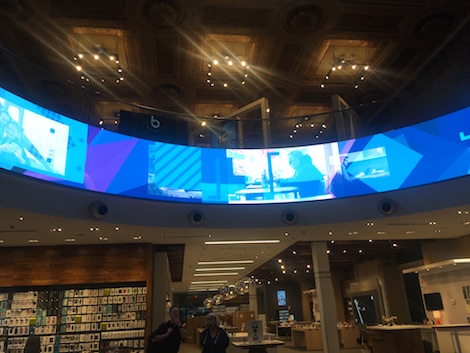
In order to click on big tables in this screenshot , I will do `click(314, 337)`, `click(346, 333)`, `click(402, 338)`.